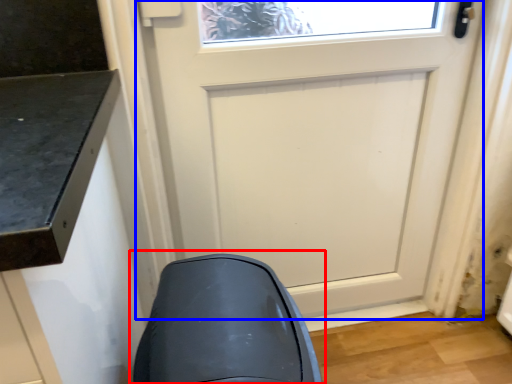
Question: Which point is closer to the camera, swivel chair (highlighted by a red box) or door (highlighted by a blue box)?

Choices:
 (A) swivel chair
 (B) door

Answer: (A)